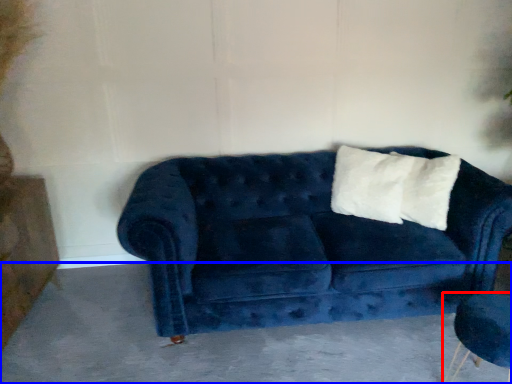
Question: Which object is further to the camera taking this photo, armchair (highlighted by a red box) or concrete (highlighted by a blue box)?

Choices:
 (A) armchair
 (B) concrete

Answer: (B)